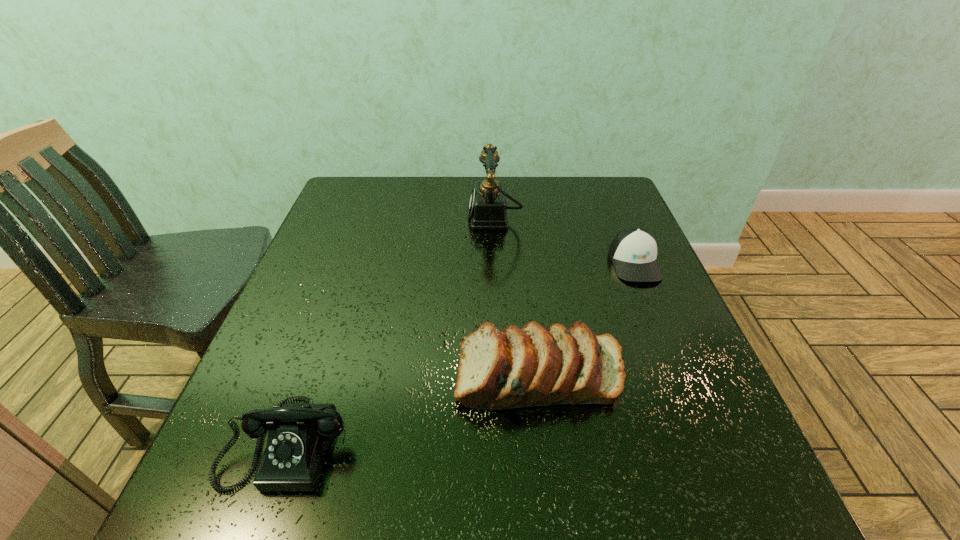
Identify the location of vacant space that satisfies the following two spatial constraints: 1. on the back side of the bread; 2. on the front of the right telephone at the rotary dial. This screenshot has width=960, height=540. (x=520, y=218).